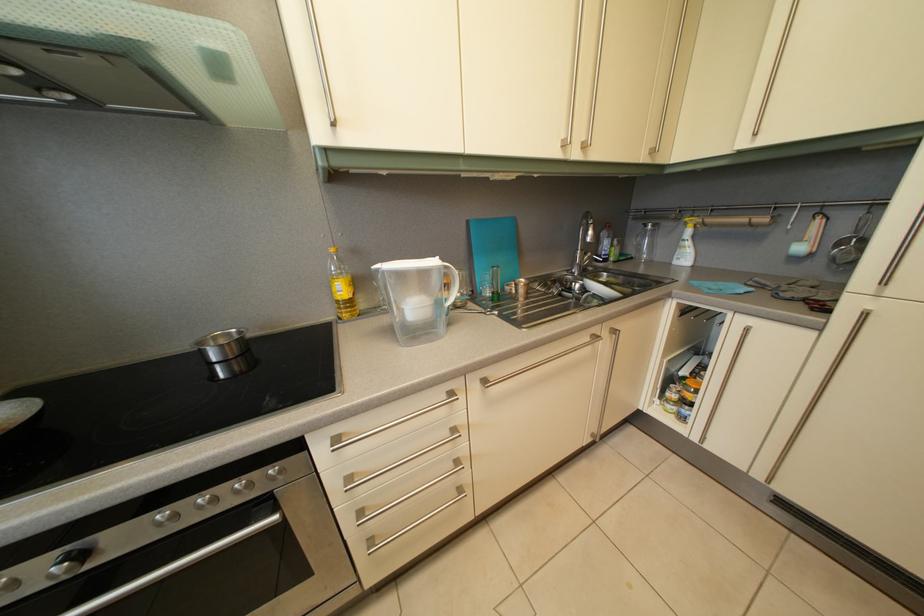
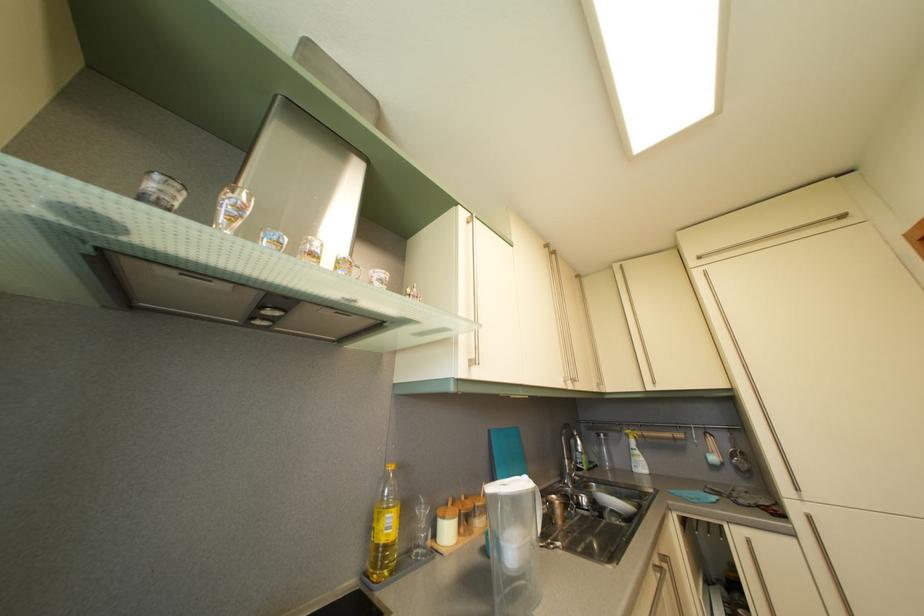
Where in the second image is the point corresponding to (841,267) from the first image?

(746, 476)